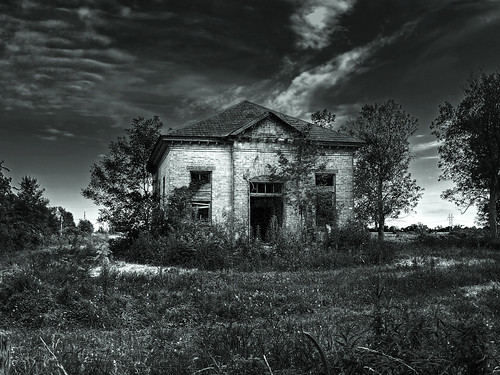
Where is `small square window over entryway`? The height and width of the screenshot is (375, 500). small square window over entryway is located at coordinates (251, 187), (259, 187), (267, 187), (276, 187).